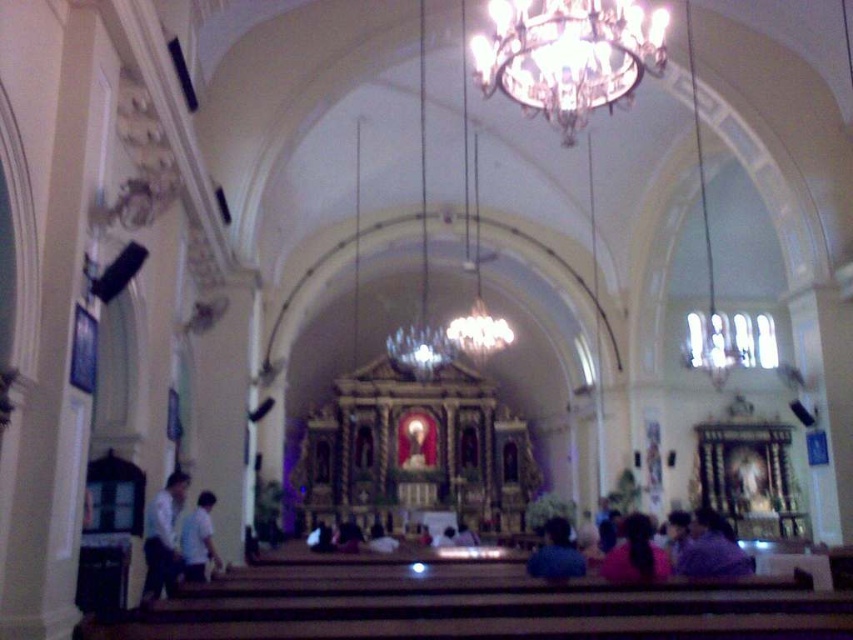
Question: Which of these objects is positioned farthest from the purple matte shirt at lower right?

Choices:
 (A) white matte shirt at lower left
 (B) dark blue shirt at center
 (C) light blue shirt at lower left

Answer: (A)

Question: Does crystal glass chandelier at upper center have a lesser width compared to dark purple fabric at center?

Choices:
 (A) yes
 (B) no

Answer: (A)

Question: Can you confirm if purple matte shirt at lower right is smaller than dark purple fabric at center?

Choices:
 (A) yes
 (B) no

Answer: (B)

Question: Which is farther from the light blue shirt at lower left?

Choices:
 (A) crystal glass chandelier at upper center
 (B) white matte shirt at lower left

Answer: (A)

Question: Can you confirm if crystal glass chandelier at upper center is positioned below light blue shirt at lower left?

Choices:
 (A) no
 (B) yes

Answer: (A)

Question: Which point is closer to the camera?

Choices:
 (A) (x=161, y=580)
 (B) (x=732, y=563)

Answer: (B)